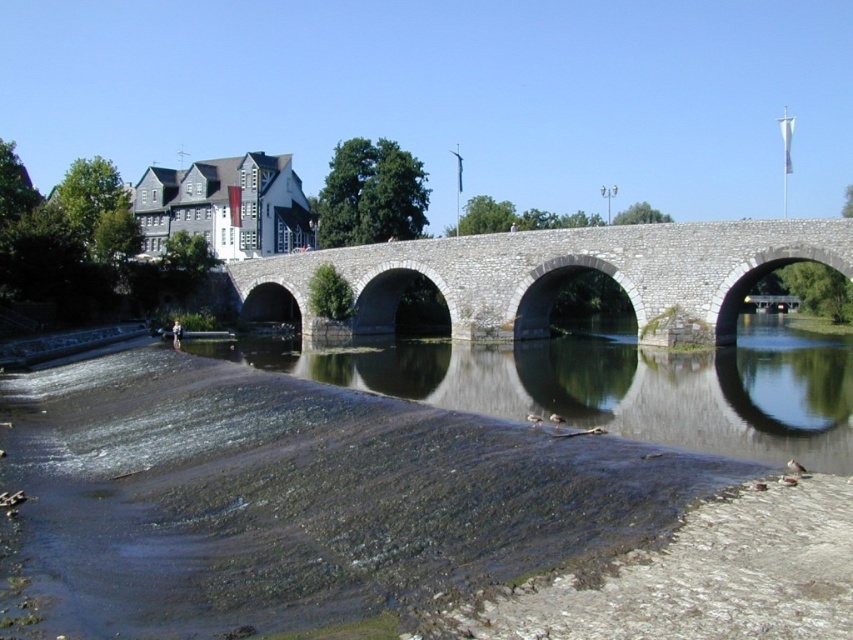
Does brown stone river at center have a larger size compared to gray stone bridge at center?

Incorrect, brown stone river at center is not larger than gray stone bridge at center.

Is brown stone river at center above gray stone bridge at center?

No, brown stone river at center is not above gray stone bridge at center.

Find the location of a particular element. This screenshot has height=640, width=853. brown stone river at center is located at coordinates (392, 515).

In order to click on brown stone river at center in this screenshot , I will do `click(392, 515)`.